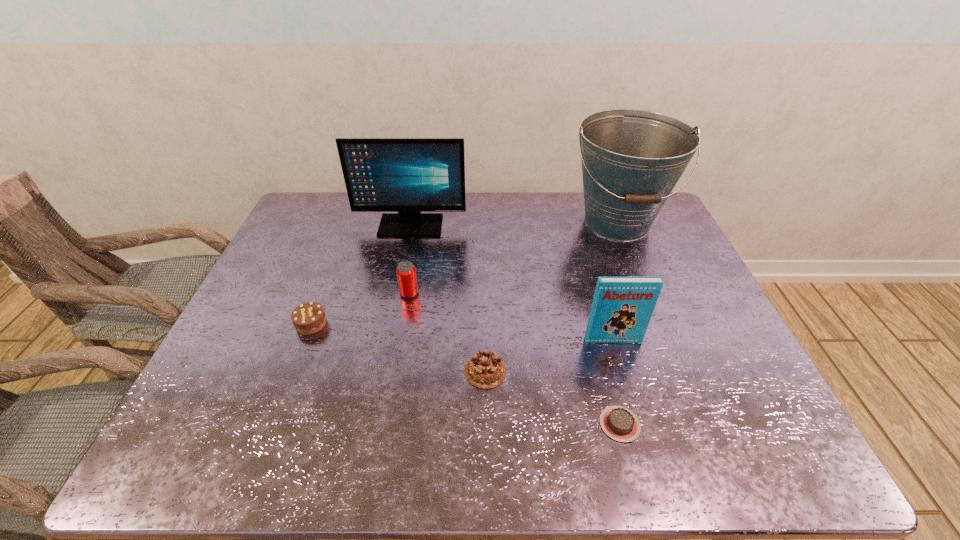
Where is `the nearest object`? the nearest object is located at coordinates (619, 423).

The height and width of the screenshot is (540, 960). Find the location of `the shortest chocolate cake`. the shortest chocolate cake is located at coordinates (619, 423).

I want to click on free location located 0.210m with the handle on opposite sides of the bucket, so click(649, 302).

This screenshot has height=540, width=960. Find the location of `vacant area located 0.170m on the screen side of the monitor`. vacant area located 0.170m on the screen side of the monitor is located at coordinates (401, 271).

Where is `vacant region located 0.230m on the front cover of the fifth farthest object`? vacant region located 0.230m on the front cover of the fifth farthest object is located at coordinates (638, 428).

Where is `vacant space located on the left of the can`? The width and height of the screenshot is (960, 540). vacant space located on the left of the can is located at coordinates (322, 294).

The width and height of the screenshot is (960, 540). What are the coordinates of `vacant region located on the right of the tallest chocolate cake` in the screenshot? It's located at (376, 323).

Where is `free region located on the left of the second nearest chocolate cake`? free region located on the left of the second nearest chocolate cake is located at coordinates (435, 371).

What are the coordinates of `vacant space located on the back of the nearest object` in the screenshot? It's located at (595, 328).

Where is `bucket present at the far edge`? bucket present at the far edge is located at coordinates (632, 159).